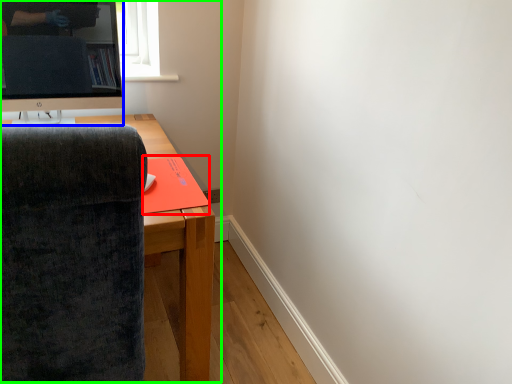
Question: Estimate the real-world distances between objects in this image. Which object is closer to book (highlighted by a red box), television (highlighted by a blue box) or entertainment center (highlighted by a green box)?

Choices:
 (A) television
 (B) entertainment center

Answer: (B)